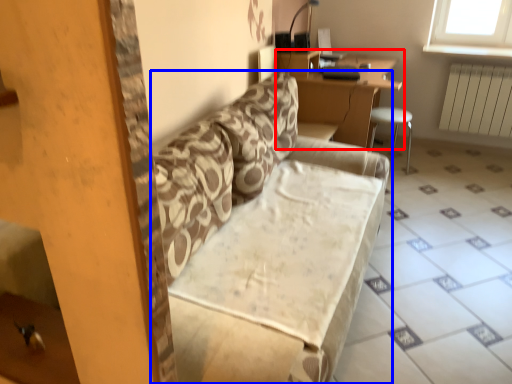
Question: Which point is further to the camera, table (highlighted by a red box) or studio couch (highlighted by a blue box)?

Choices:
 (A) table
 (B) studio couch

Answer: (A)